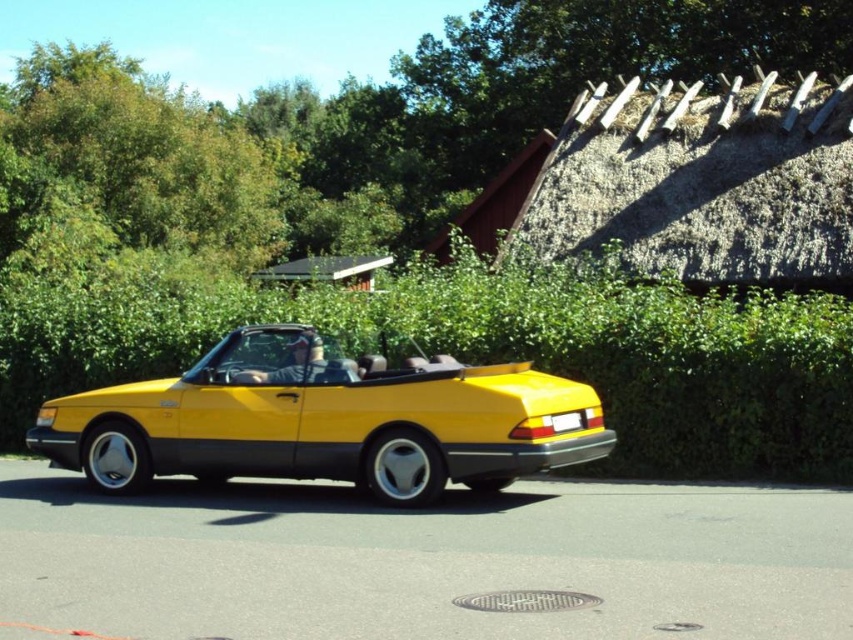
You are a delivery driver who needs to park your truck next to the yellow matte convertible at center and the wooden thatched hut at upper center. Which object should you avoid parking near to ensure your truck fits?

You should avoid parking near the yellow matte convertible at center because its width is larger than the wooden thatched hut at upper center, so the truck may not fit near the wider object.

You are a photographer planning to take a picture of the green leafy hedge at center and the wooden thatched hut at upper center. Which object should you focus on first if you want to capture both in a single frame without moving the camera?

The green leafy hedge at center is larger in size than the wooden thatched hut at upper center, so you should focus on the green leafy hedge at center first to ensure it fills the frame appropriately before adjusting for the smaller wooden thatched hut at upper center.

You are a driver trying to park your car in the parking lot. You see the green leafy hedge at center and the yellow matte convertible at center. Which object is closer to you?

The green leafy hedge at center is positioned over the yellow matte convertible at center, meaning it is closer to you.